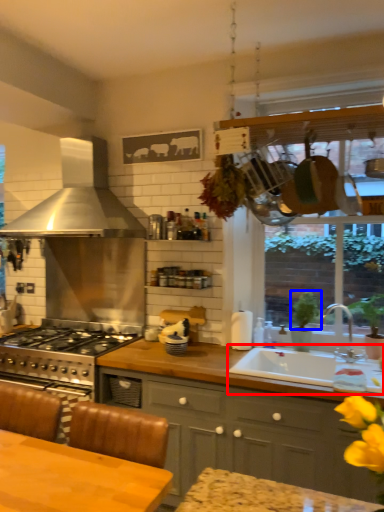
Question: Which object is closer to the camera taking this photo, sink (highlighted by a red box) or plant (highlighted by a blue box)?

Choices:
 (A) sink
 (B) plant

Answer: (A)